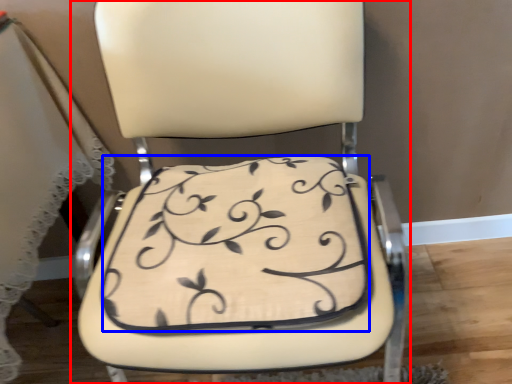
Question: Which object appears closest to the camera in this image, chair (highlighted by a red box) or pillow (highlighted by a blue box)?

Choices:
 (A) chair
 (B) pillow

Answer: (A)